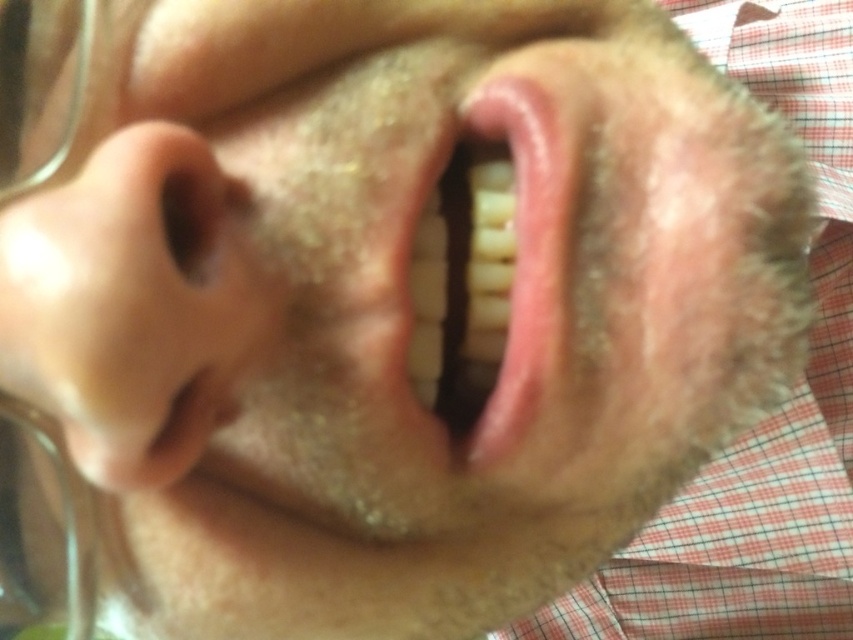
Is point (83, 220) positioned after point (503, 390)?

No.

Consider the image. Does smooth skin nose at left appear over pink glossy lips at center?

Actually, smooth skin nose at left is below pink glossy lips at center.

Where is `smooth skin nose at left`? smooth skin nose at left is located at coordinates (131, 305).

The image size is (853, 640). I want to click on smooth skin nose at left, so click(131, 305).